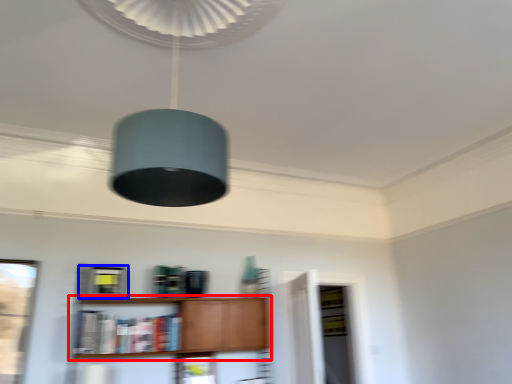
Question: Which of the following is the closest to the observer, shelf (highlighted by a red box) or cabinetry (highlighted by a blue box)?

Choices:
 (A) shelf
 (B) cabinetry

Answer: (A)